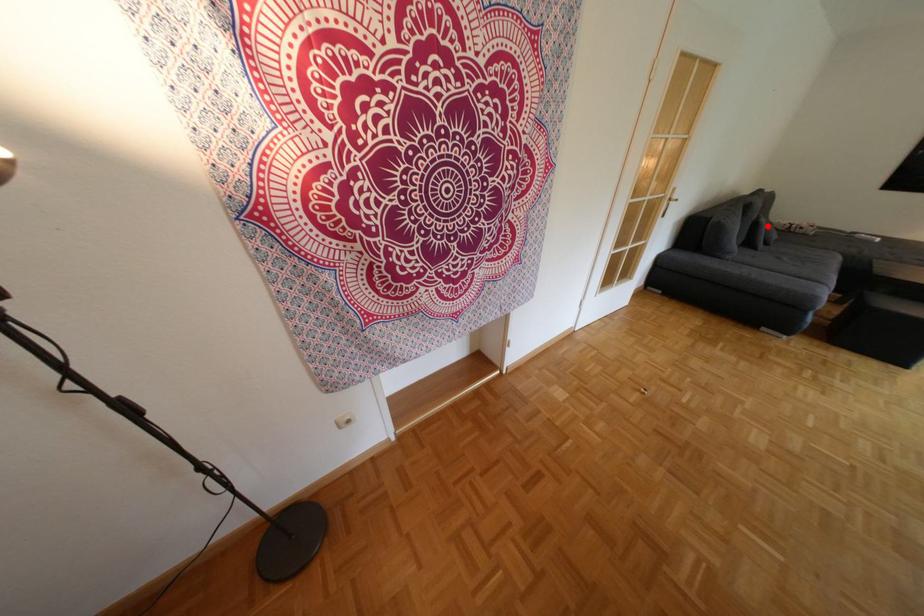
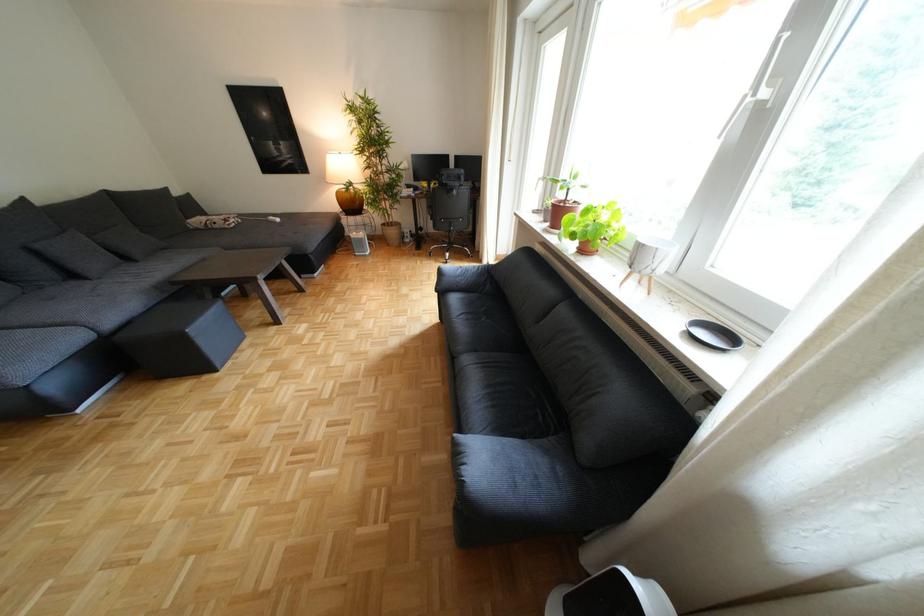
Question: A red point is marked in image1. In image2, is the corresponding 3D point closer to the camera or farther? Reply with the corresponding letter.

Choices:
 (A) The corresponding 3D point is closer.
 (B) The corresponding 3D point is farther.

Answer: (B)